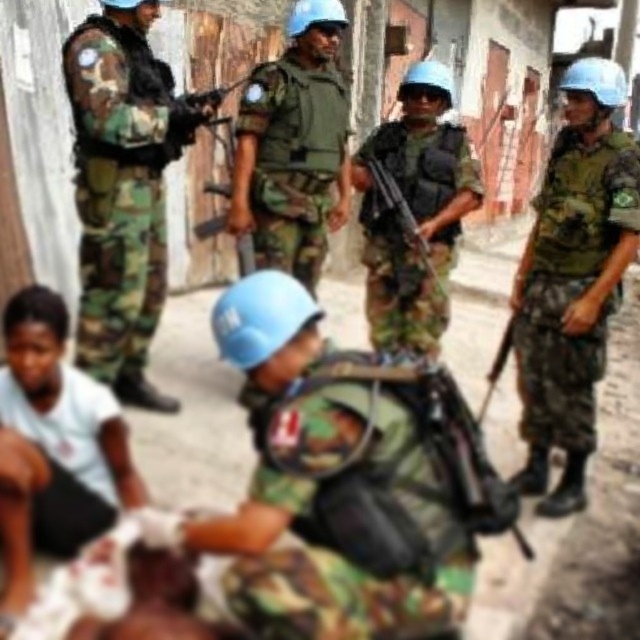
You are a soldier in the alleyway and need to quickly hand a medical kit to the person in the white matte shirt at lower left. Which direction should you move to reach them from your current position near the camouflage fabric uniform at left?

The camouflage fabric uniform at left is to the left of the white matte shirt at lower left. To reach the white matte shirt at lower left, you should move to the right.

In the scene shown: You are a soldier in the alleyway and need to reach a critical point at coordinates point (84, 394). Your team has a rope that can extend up to 10 feet. Can you safely reach that point using the rope?

The distance of point (84, 394) from camera is 9.47 feet. Since the rope can extend up to 10 feet, you can safely reach the point as the distance is within the rope length.